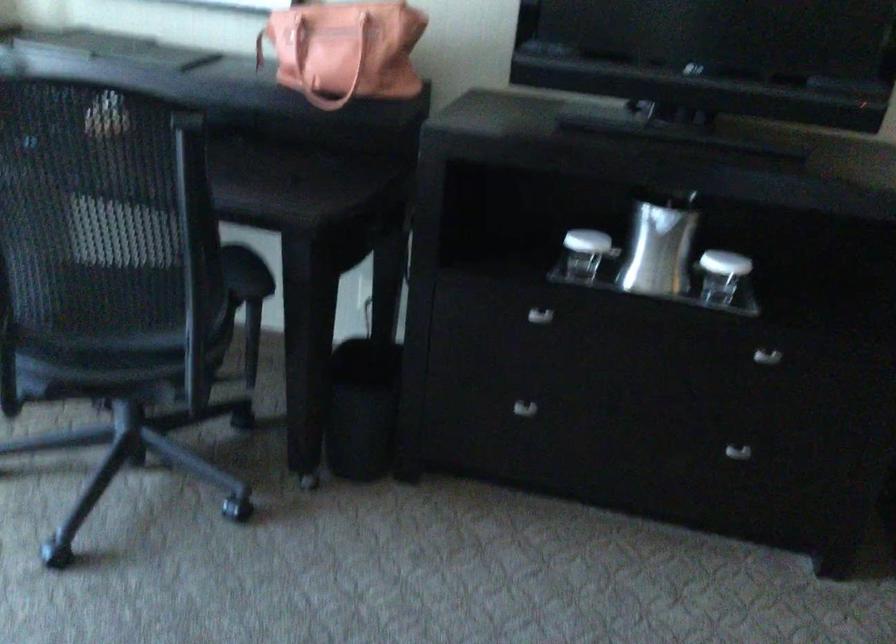
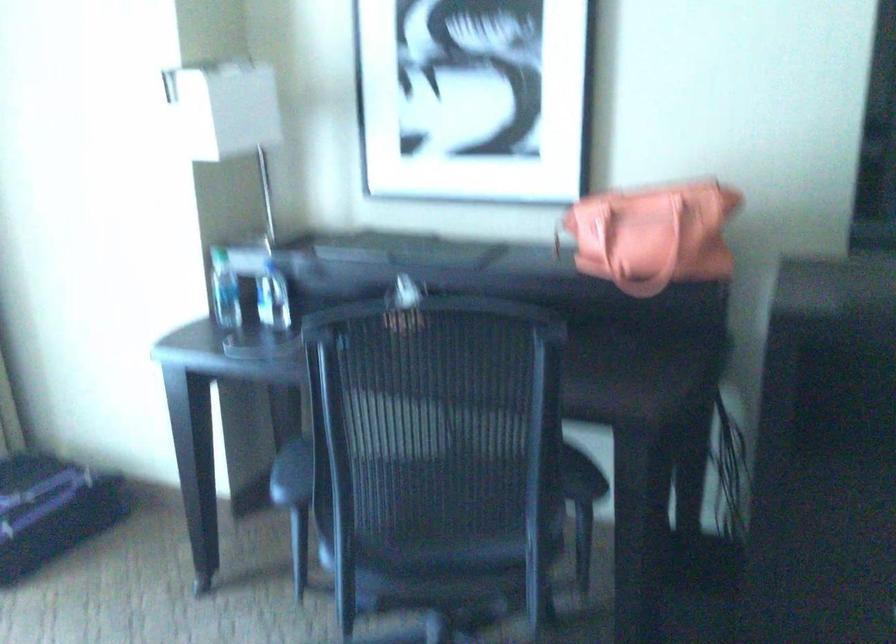
Question: Based on the continuous images, in which direction is the camera rotating? Reply with the corresponding letter.

Choices:
 (A) Left
 (B) Right
 (C) Up
 (D) Down

Answer: (A)